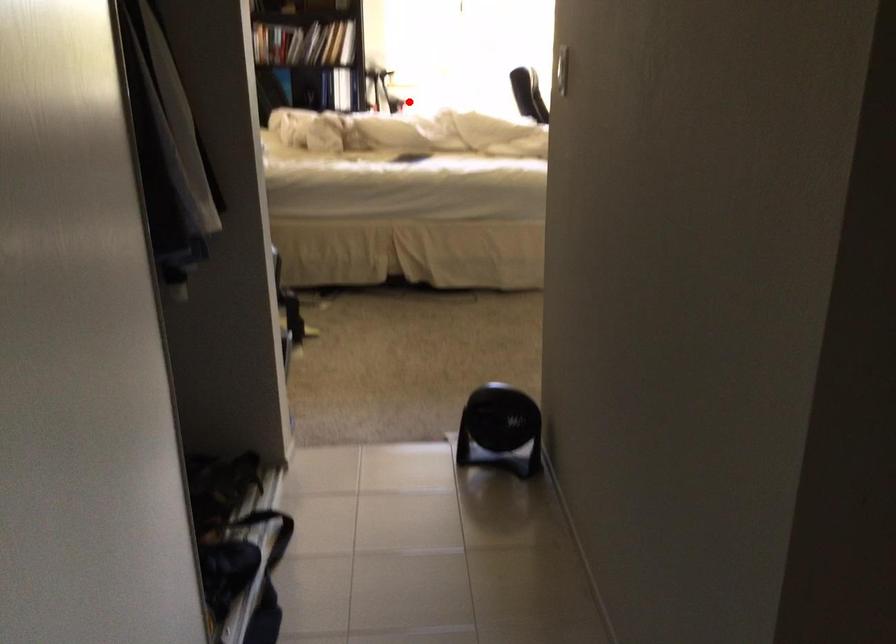
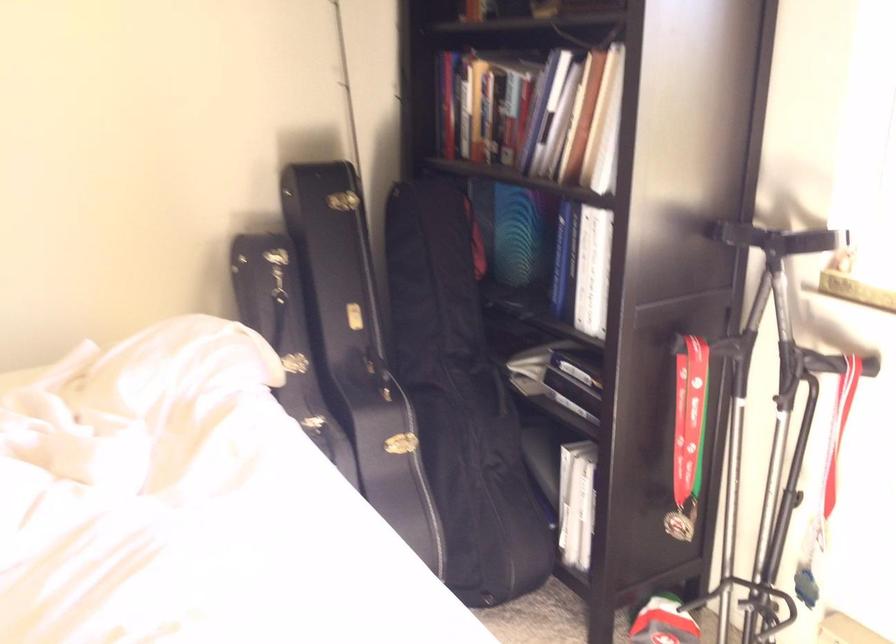
Locate, in the second image, the point that corresponds to the highlighted location in the first image.

(764, 413)